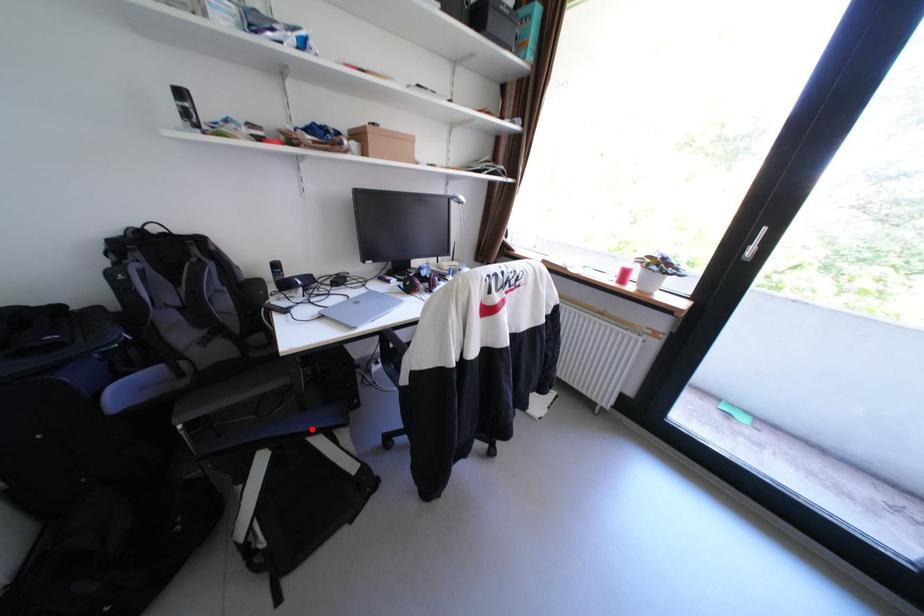
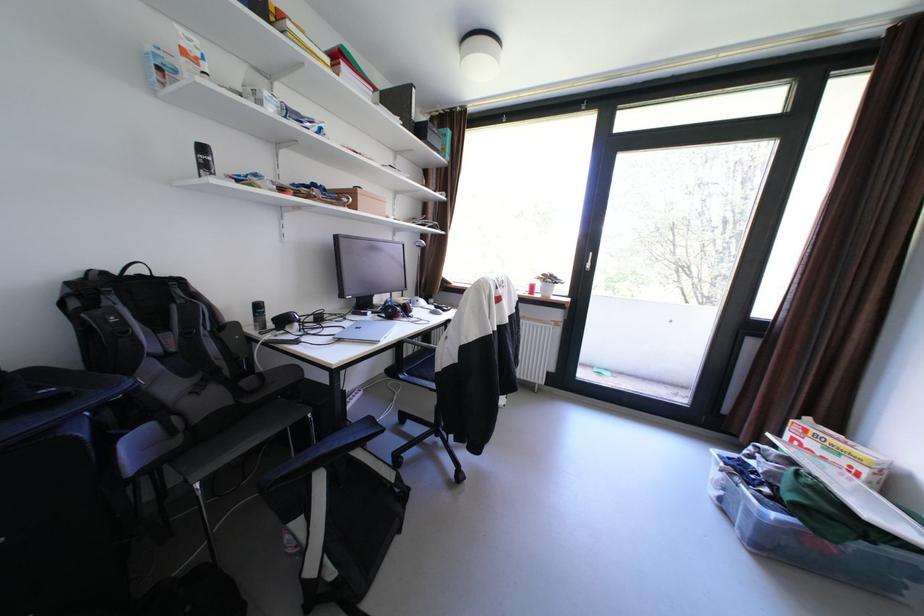
The point at the highlighted location is marked in the first image. Where is the corresponding point in the second image?

(361, 440)